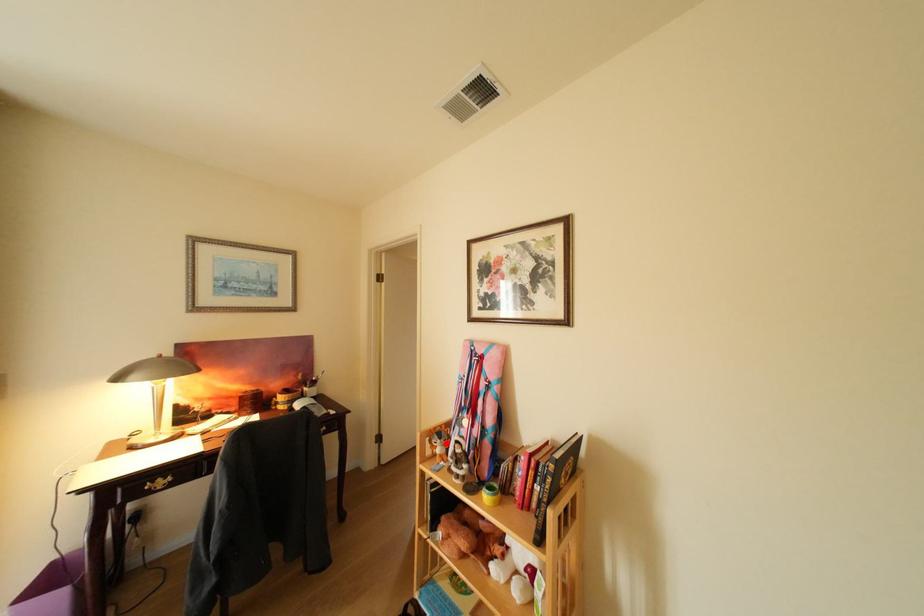
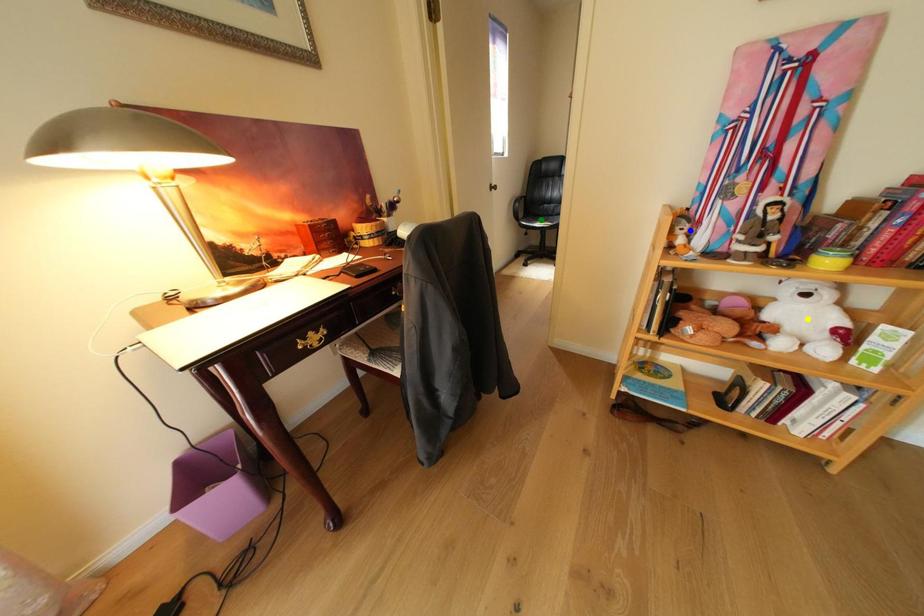
Question: I am providing you with two images of the same scene from different viewpoints. A red point is marked on the first image. You are given multiple points on the second image. Which point in image 2 represents the same 3d spot as the red point in image 1?

Choices:
 (A) yellow point
 (B) blue point
 (C) green point

Answer: (B)